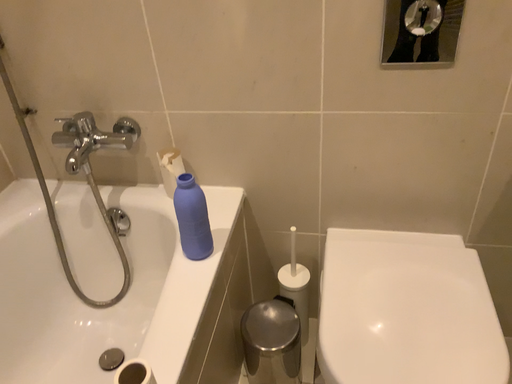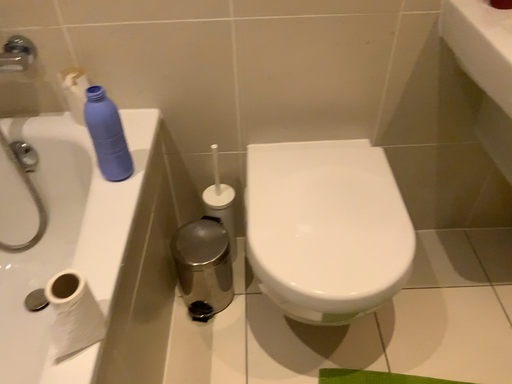
Question: Which way did the camera rotate in the video?

Choices:
 (A) rotated right
 (B) rotated left

Answer: (A)